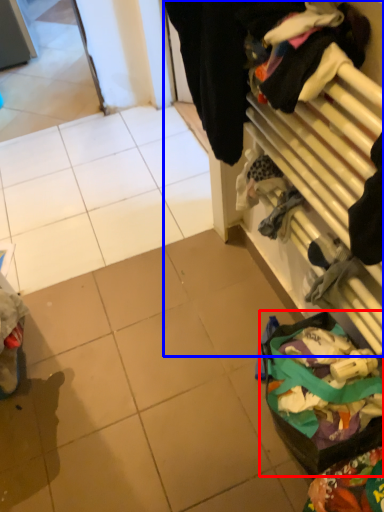
Question: Among these objects, which one is farthest to the camera, waste (highlighted by a red box) or closet (highlighted by a blue box)?

Choices:
 (A) waste
 (B) closet

Answer: (A)